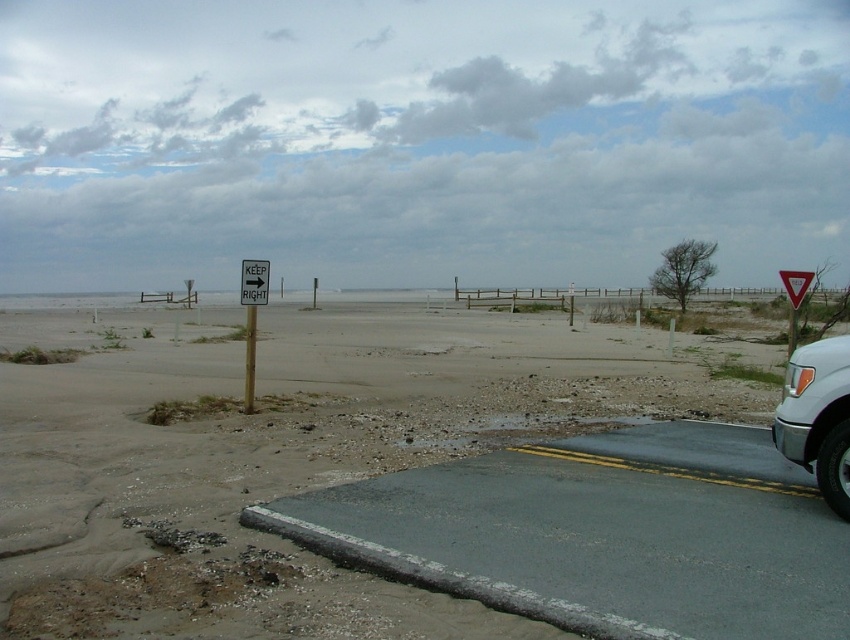
You are standing at the center of the road and looking towards the ocean. Which direction should you turn to face the sandy beach at lower left?

The sandy beach at lower left is located at coordinates (398, 484), so you should turn to your left to face it.

You are standing at the point marked by the coordinates (398, 484) on the image. Looking towards the sandy beach at lower left, which direction should you walk to reach the asphalt road?

The sandy beach at lower left is located to your left side, so you should walk to your right to reach the asphalt road.